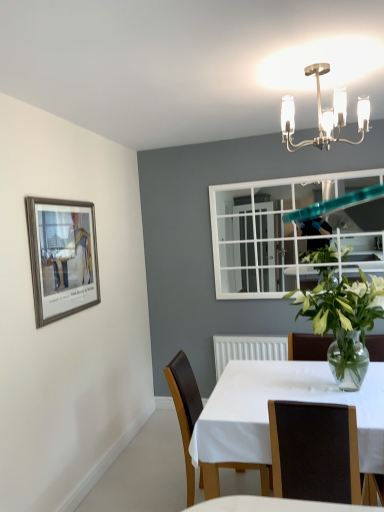
Locate an element on the screen. free space above white glossy table at center (from a real-world perspective) is located at coordinates (289, 387).